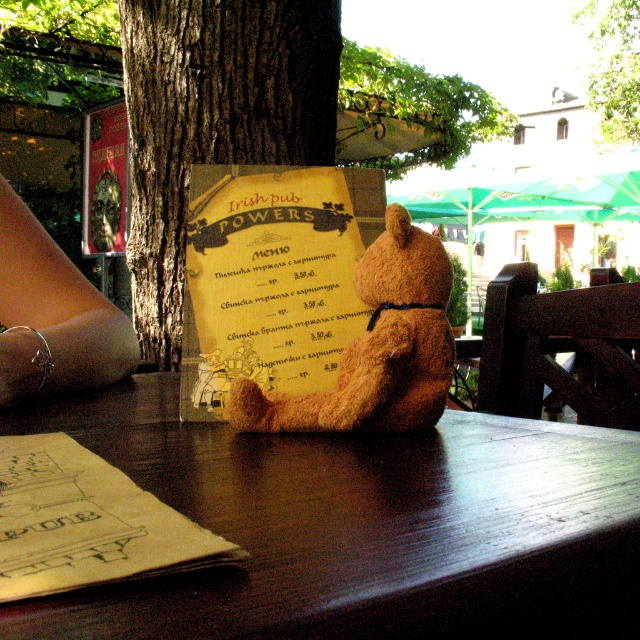
You are a customer sitting at the brown wooden table at center in the Irish pub. You want to place your drink on the table. Will the drink be under the brown rough bark tree at center?

The brown wooden table at center is below the brown rough bark tree at center, so placing your drink on the table will also place it under the tree.

You are a photographer standing at the entrance of the Powers pub. You want to take a photo of the brown wooden table at center so that it fills the frame without cropping. The camera you are using has a minimum focusing distance of 8 inches. Will you be able to take the photo from your current position?

The brown wooden table at center is 8.40 inches away from the camera. Since the minimum focusing distance is 8 inches, you can take the photo from your current position as the distance is within the camera capability.